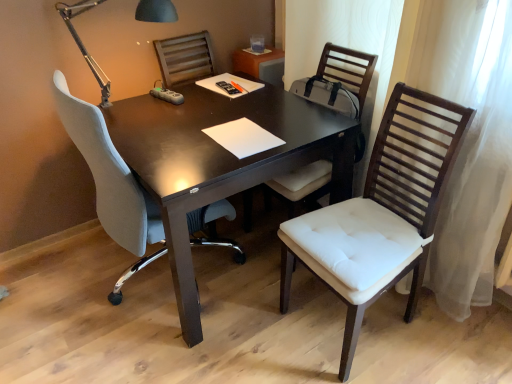
Where is `free spot below white padded chair at right, the 3th chair from the left (from a real-world perspective)`? Image resolution: width=512 pixels, height=384 pixels. free spot below white padded chair at right, the 3th chair from the left (from a real-world perspective) is located at coordinates (346, 321).